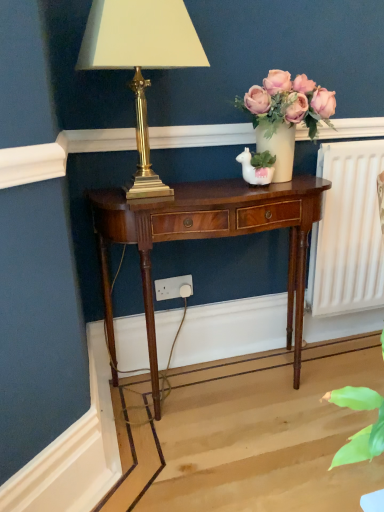
Find the location of a particular element. The height and width of the screenshot is (512, 384). vacant area that is in front of mahogany wood nightstand at center is located at coordinates (228, 456).